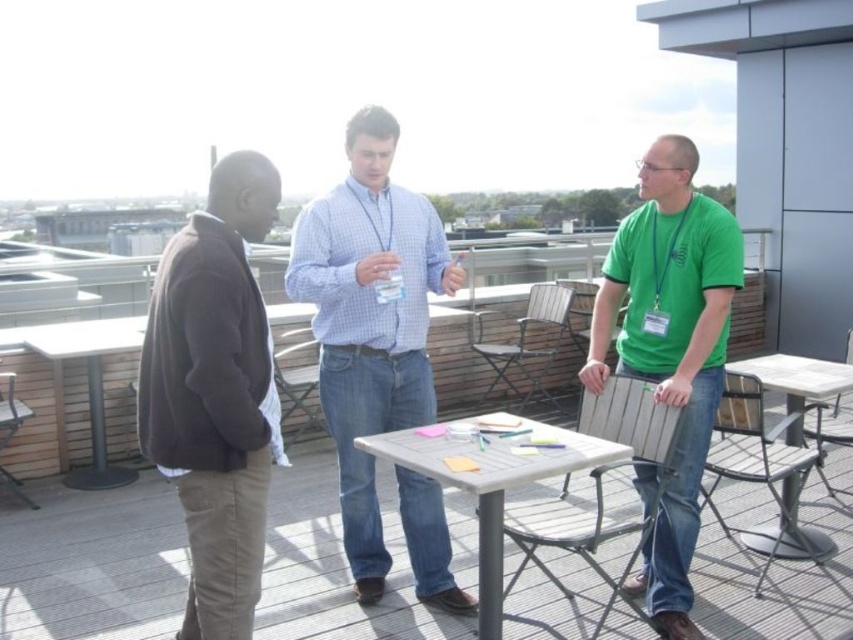
Between white plastic table at right and metallic gray table at left, which one has less height?

Standing shorter between the two is white plastic table at right.

Can you confirm if white plastic table at right is shorter than metallic gray table at left?

Indeed, white plastic table at right has a lesser height compared to metallic gray table at left.

Which is in front, point (784, 516) or point (53, 328)?

Point (784, 516)

Where is `white plastic table at right`? white plastic table at right is located at coordinates (796, 384).

Looking at this image, does dark brown sweater at left appear on the right side of white plastic table at right?

Incorrect, dark brown sweater at left is not on the right side of white plastic table at right.

Is point (148, 448) behind point (778, 369)?

No, (148, 448) is closer to viewer.

Locate an element on the screen. dark brown sweater at left is located at coordinates pyautogui.click(x=215, y=394).

Is dark brown sweater at left bigger than wooden chair at center?

Actually, dark brown sweater at left might be smaller than wooden chair at center.

Does dark brown sweater at left appear on the left side of wooden chair at center?

Yes, dark brown sweater at left is to the left of wooden chair at center.

Identify the location of dark brown sweater at left. (215, 394).